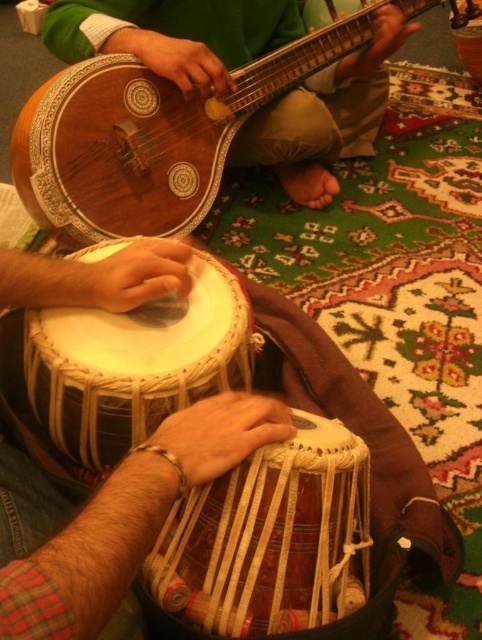
Question: Is wooden guitar at upper left smaller than white woven drum at center?

Choices:
 (A) no
 (B) yes

Answer: (A)

Question: Based on their relative distances, which object is farther from the wooden guitar at upper left?

Choices:
 (A) brown woven drum at center
 (B) white woven drum at center

Answer: (A)

Question: Can you confirm if brown woven drum at center is positioned above white woven drum at center?

Choices:
 (A) no
 (B) yes

Answer: (A)

Question: Among these points, which one is farthest from the camera?

Choices:
 (A) (348, 579)
 (B) (13, 374)

Answer: (B)

Question: Among these points, which one is farthest from the camera?

Choices:
 (A) (88, 426)
 (B) (35, 170)

Answer: (B)

Question: Considering the relative positions of wooden guitar at upper left and brown woven drum at center in the image provided, where is wooden guitar at upper left located with respect to brown woven drum at center?

Choices:
 (A) left
 (B) right

Answer: (B)